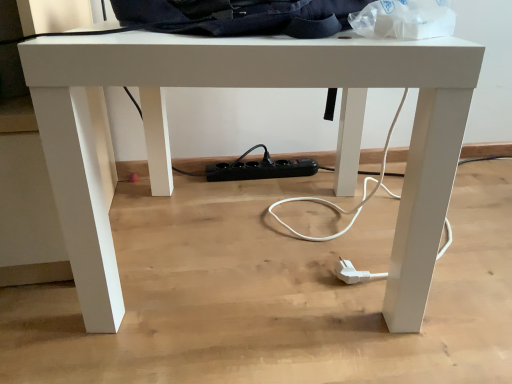
Question: Looking at their shapes, would you say dark blue fabric messenger bag at upper center is wider or thinner than transparent plastic bag at upper right?

Choices:
 (A) wide
 (B) thin

Answer: (A)

Question: From a real-world perspective, is dark blue fabric messenger bag at upper center physically located above or below transparent plastic bag at upper right?

Choices:
 (A) below
 (B) above

Answer: (B)

Question: Is dark blue fabric messenger bag at upper center bigger or smaller than transparent plastic bag at upper right?

Choices:
 (A) small
 (B) big

Answer: (B)

Question: Is point (411, 13) positioned closer to the camera than point (239, 18)?

Choices:
 (A) farther
 (B) closer

Answer: (B)

Question: Do you think transparent plastic bag at upper right is within dark blue fabric messenger bag at upper center, or outside of it?

Choices:
 (A) inside
 (B) outside

Answer: (A)

Question: Is transparent plastic bag at upper right to the left or to the right of dark blue fabric messenger bag at upper center in the image?

Choices:
 (A) right
 (B) left

Answer: (A)

Question: In terms of height, does transparent plastic bag at upper right look taller or shorter compared to dark blue fabric messenger bag at upper center?

Choices:
 (A) short
 (B) tall

Answer: (B)